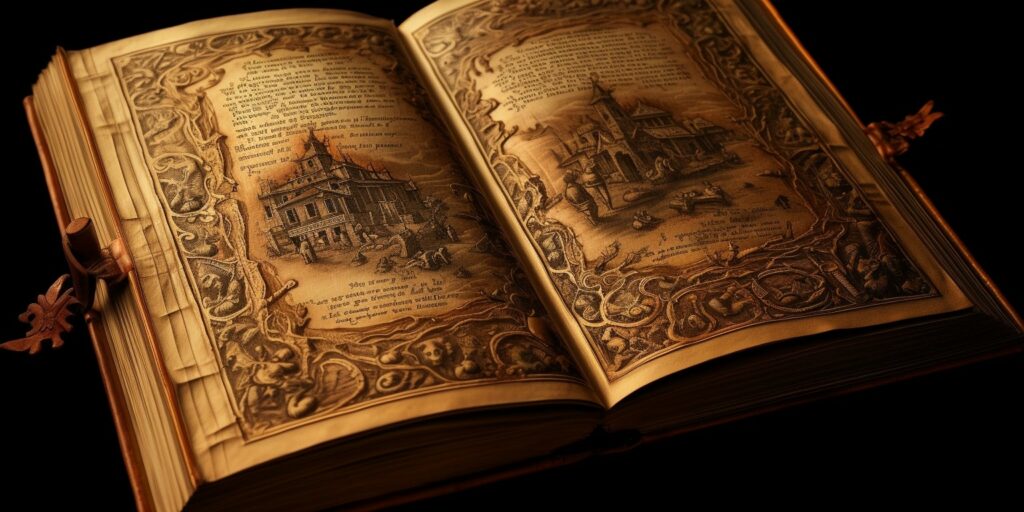
At what (x,y) coordinates should I click in order to perform the action: click on lock. Please return your answer as a coordinate pair (x, y). Looking at the image, I should click on (906, 135).